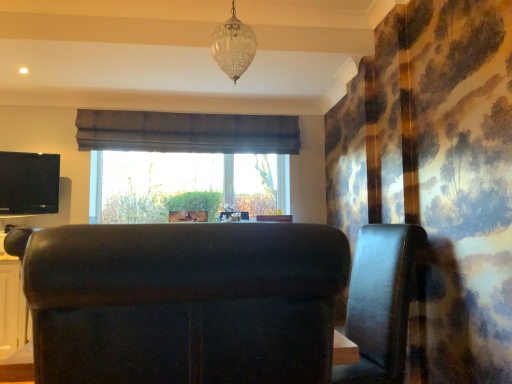
Question: In terms of height, does clear glass chandelier at upper center look taller or shorter compared to brown fabric curtain at center?

Choices:
 (A) tall
 (B) short

Answer: (A)

Question: Considering the positions of point (244, 38) and point (117, 135), is point (244, 38) closer or farther from the camera than point (117, 135)?

Choices:
 (A) farther
 (B) closer

Answer: (B)

Question: Which object is the farthest from the leather armchair at center, arranged as the second furniture when viewed from the left?

Choices:
 (A) clear glass chandelier at upper center
 (B) matte black tv at left
 (C) velvet dark brown armchair at center, which appears as the second furniture when viewed from the back
 (D) brown fabric curtain at center

Answer: (B)

Question: Which is farther from the clear glass chandelier at upper center?

Choices:
 (A) velvet dark brown armchair at center, positioned as the first furniture in front-to-back order
 (B) leather armchair at center, the first furniture from the back
 (C) matte black tv at left
 (D) brown fabric curtain at center

Answer: (C)